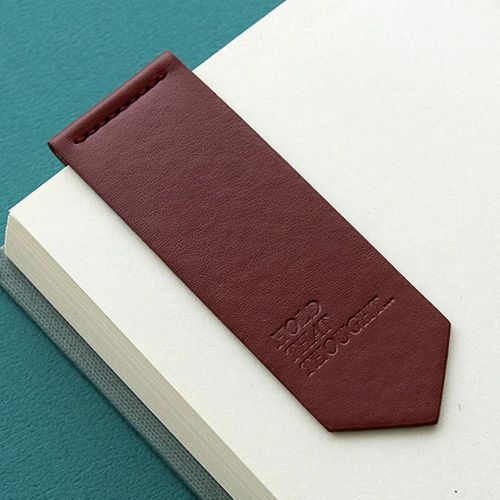
Image resolution: width=500 pixels, height=500 pixels. Identify the location of top of book. (221, 51).